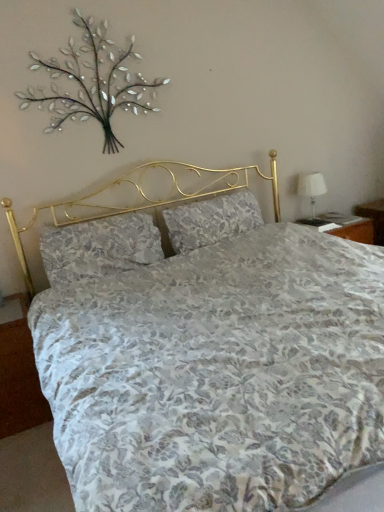
Question: From the image's perspective, is floral fabric pillow at center, positioned as the 1th pillow in right-to-left order, above or below metallic silver branches at upper left?

Choices:
 (A) below
 (B) above

Answer: (A)

Question: Is point (251, 219) closer or farther from the camera than point (77, 96)?

Choices:
 (A) farther
 (B) closer

Answer: (A)

Question: Considering the real-world distances, which object is farthest from the floral fabric pillow at center, positioned as the 1th pillow in right-to-left order?

Choices:
 (A) white fabric lampshade at right
 (B) floral fabric pillow at center, positioned as the 2th pillow in right-to-left order
 (C) metallic silver branches at upper left

Answer: (C)

Question: Which object is positioned closest to the metallic silver branches at upper left?

Choices:
 (A) white fabric lampshade at right
 (B) floral fabric pillow at center, positioned as the 2th pillow in right-to-left order
 (C) floral fabric pillow at center, which is counted as the 2th pillow, starting from the left

Answer: (B)